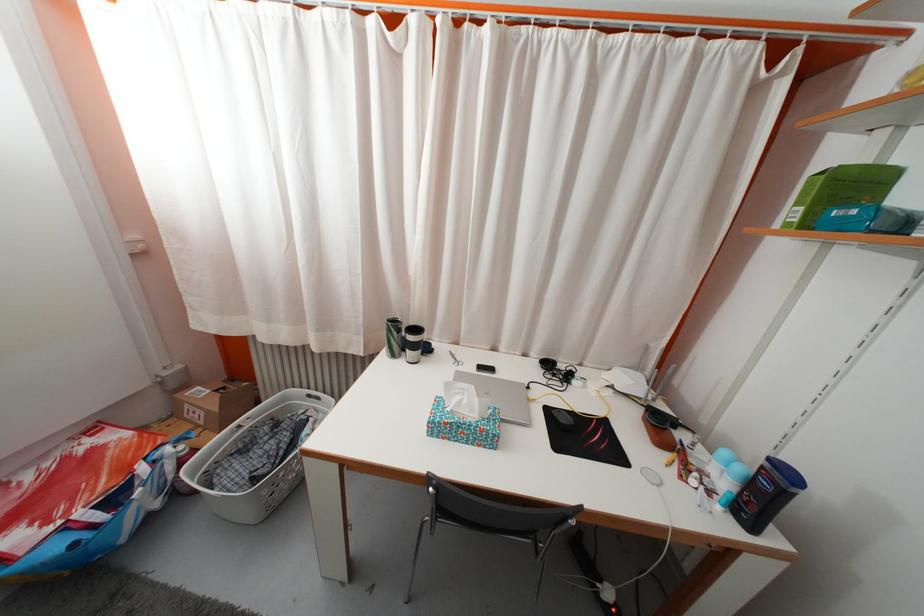
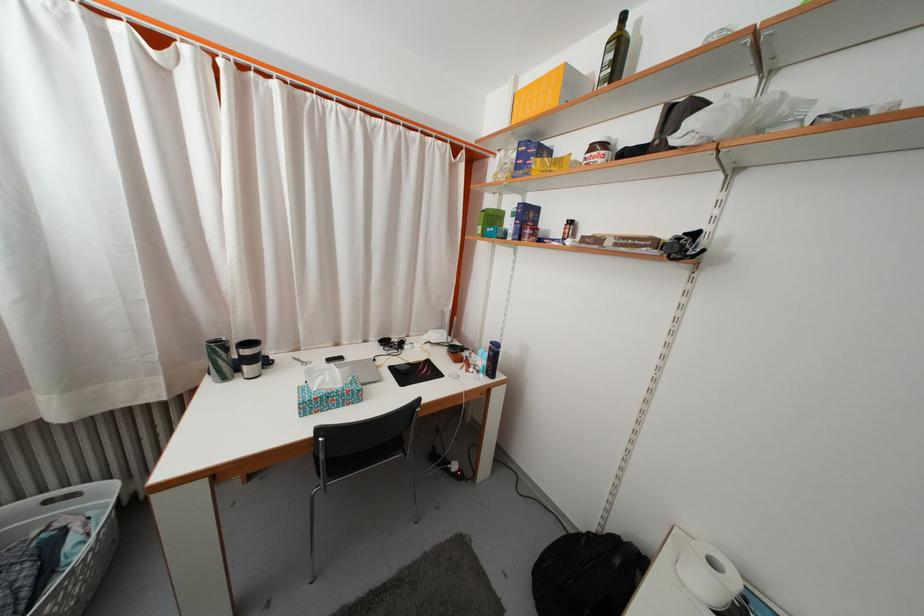
The point at (728, 460) is marked in the first image. Where is the corresponding point in the second image?

(485, 359)